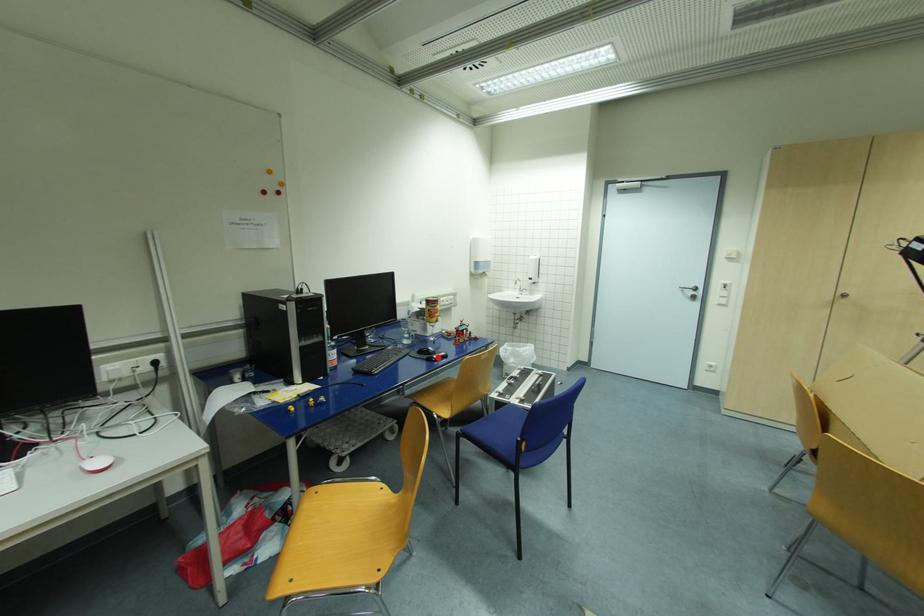
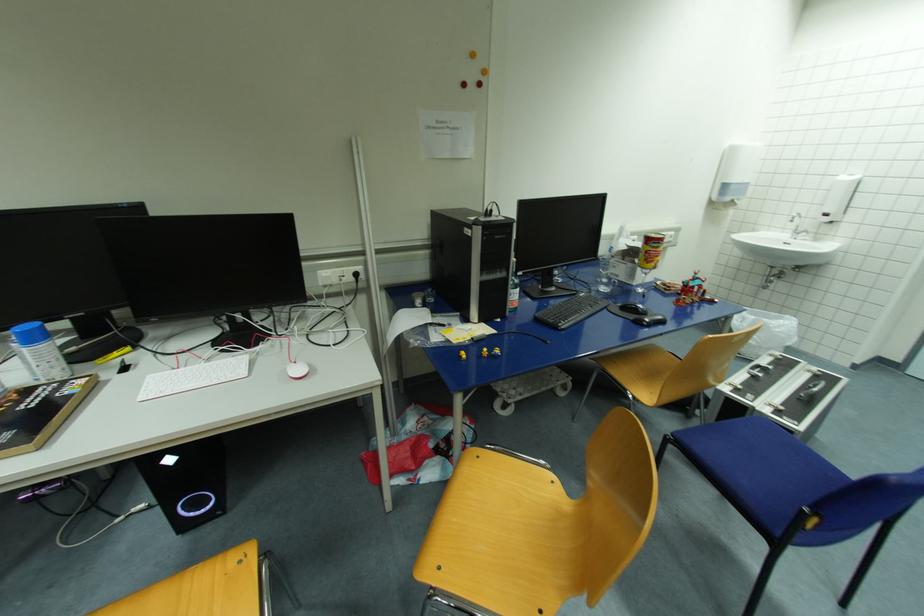
Locate, in the second image, the point that corresponds to the highlighted location in the first image.

(650, 321)